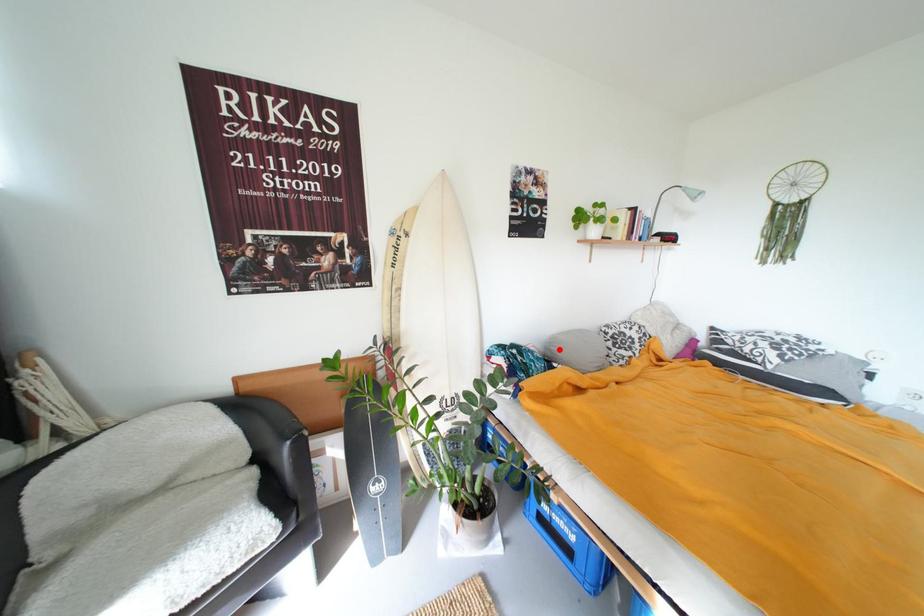
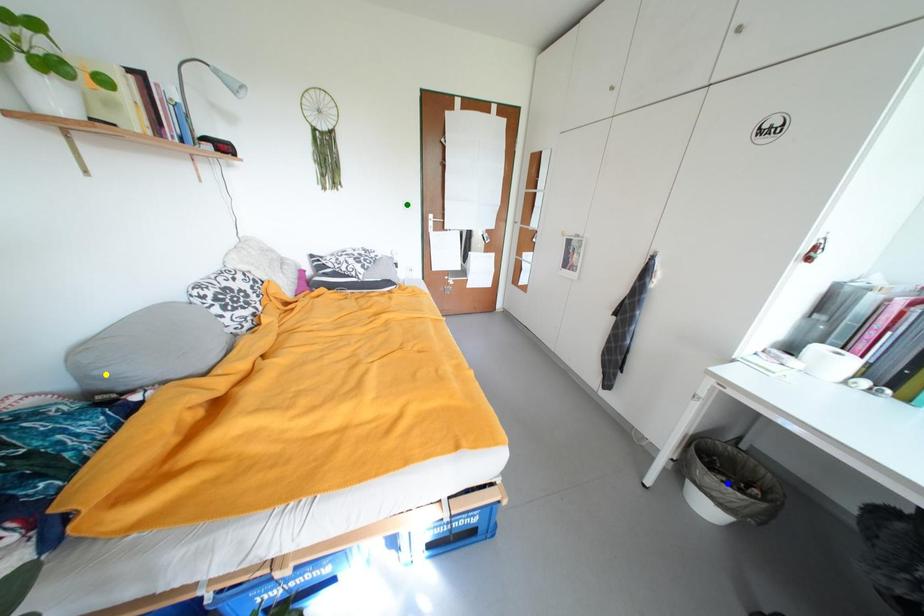
Question: I am providing you with two images of the same scene from different viewpoints. A red point is marked on the first image. You are given multiple points on the second image. Which mark in image 2 goes with the point in image 1?

Choices:
 (A) yellow point
 (B) green point
 (C) blue point

Answer: (A)